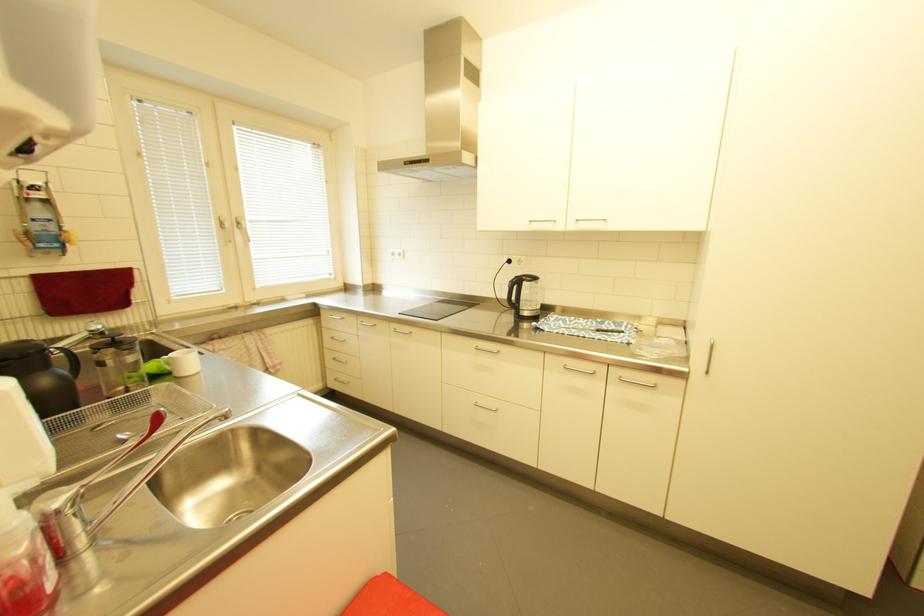
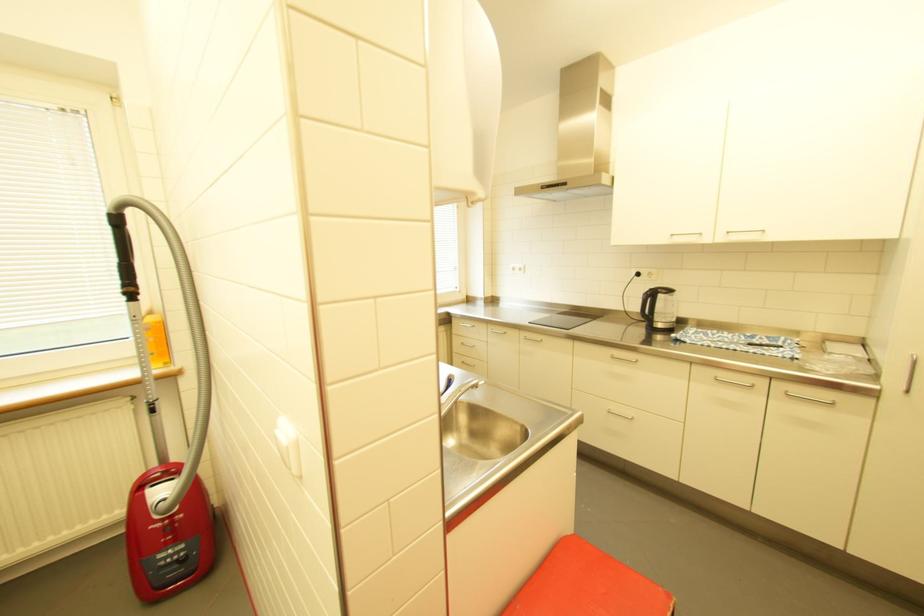
Find the pixel in the second image that matches point 484,347 in the first image.

(621, 355)